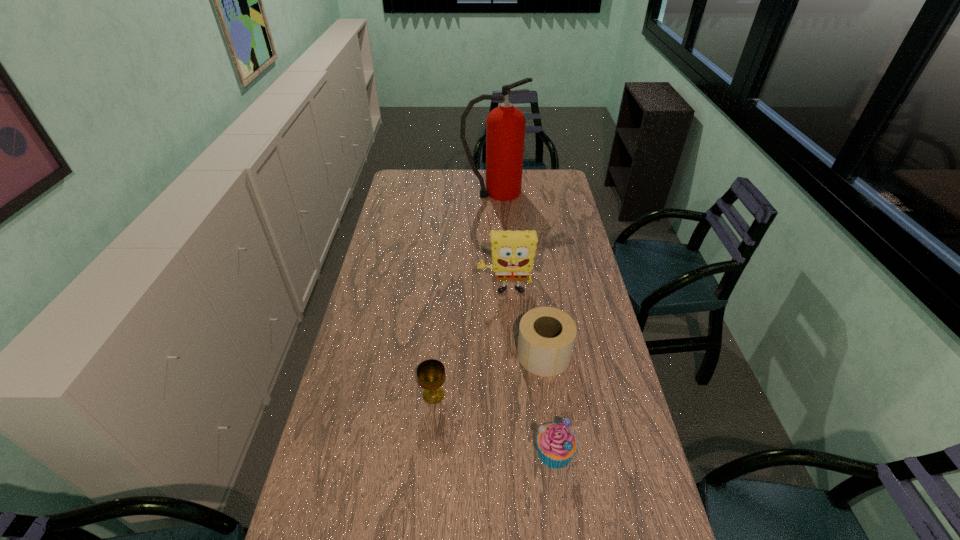
The image size is (960, 540). What are the coordinates of `free spot located on the left of the third nearest object` in the screenshot? It's located at (415, 354).

Locate an element on the screen. The image size is (960, 540). free space located 0.330m on the back of the chalice is located at coordinates tap(442, 307).

This screenshot has height=540, width=960. In order to click on vacant area located 0.180m on the right of the nearest object in this screenshot , I will do `click(640, 451)`.

Locate an element on the screen. Image resolution: width=960 pixels, height=540 pixels. object located at the far edge is located at coordinates (505, 125).

Where is `object located at the right edge`? This screenshot has height=540, width=960. object located at the right edge is located at coordinates (547, 335).

At what (x,y) coordinates should I click in order to perform the action: click on vacant space at the far edge. Please return your answer as a coordinate pair (x, y). Looking at the image, I should click on (471, 175).

Locate an element on the screen. The width and height of the screenshot is (960, 540). free space at the left edge of the desktop is located at coordinates (380, 396).

In order to click on blank area at the right edge in this screenshot , I will do `click(581, 363)`.

Locate an element on the screen. This screenshot has width=960, height=540. vacant space at the far right corner of the desktop is located at coordinates (540, 170).

This screenshot has height=540, width=960. Identify the location of empty space between the third nearest object and the muffin. (549, 403).